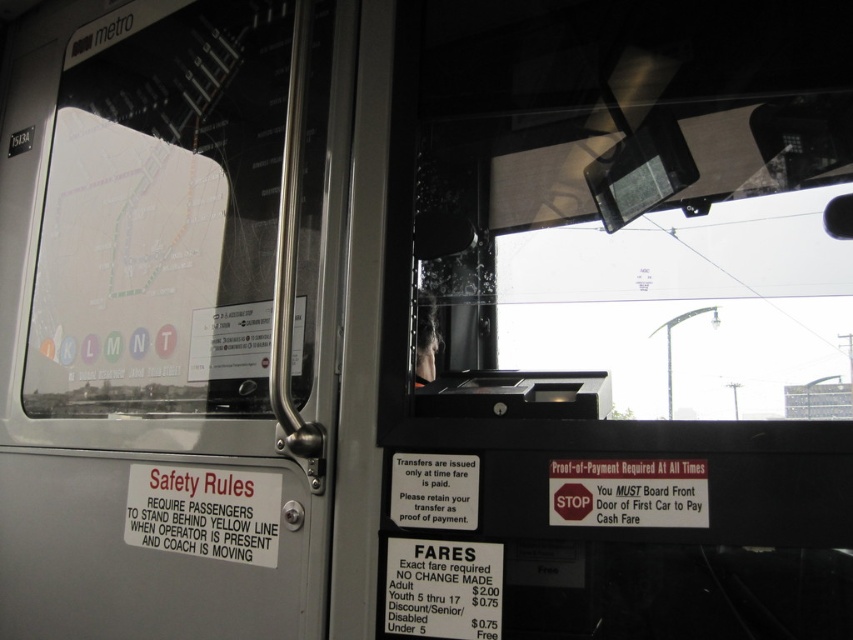
Can you confirm if gray metallic door at left is thinner than transparent glass windshield at center?

No, gray metallic door at left is not thinner than transparent glass windshield at center.

Which is more to the left, gray metallic door at left or transparent glass windshield at center?

Positioned to the left is gray metallic door at left.

Is point (100, 38) positioned behind point (514, 166)?

Yes, it is behind point (514, 166).

Locate an element on the screen. This screenshot has width=853, height=640. gray metallic door at left is located at coordinates (167, 317).